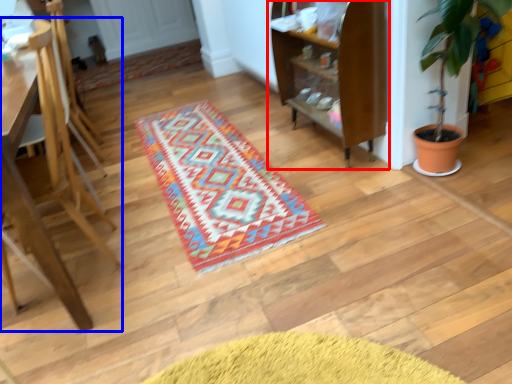
Question: Which of the following is the farthest to the observer, shelf (highlighted by a red box) or furniture (highlighted by a blue box)?

Choices:
 (A) shelf
 (B) furniture

Answer: (A)